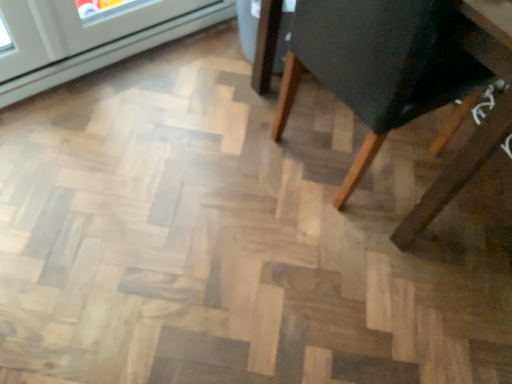
Where is `free region on the left part of black matte chair at upper right`? This screenshot has width=512, height=384. free region on the left part of black matte chair at upper right is located at coordinates (213, 134).